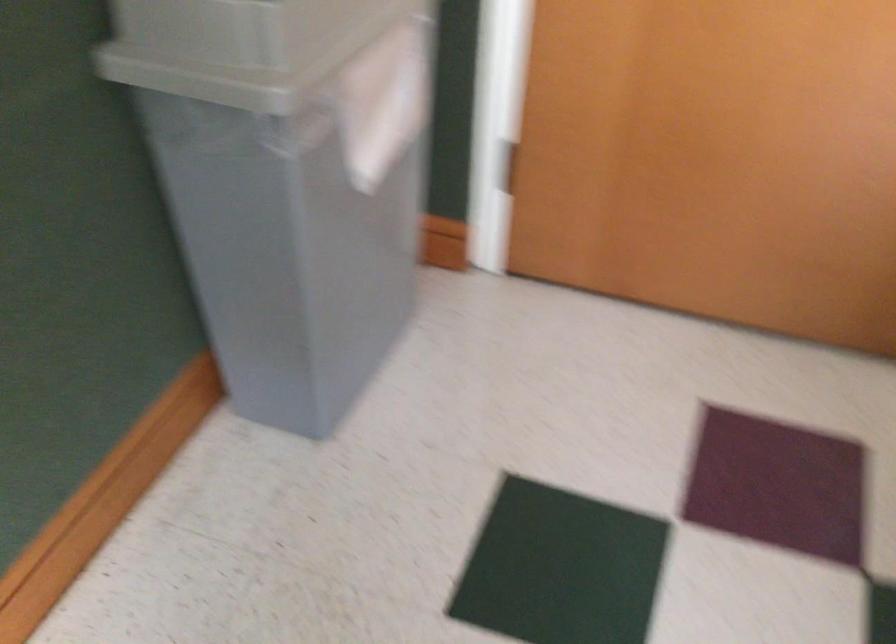
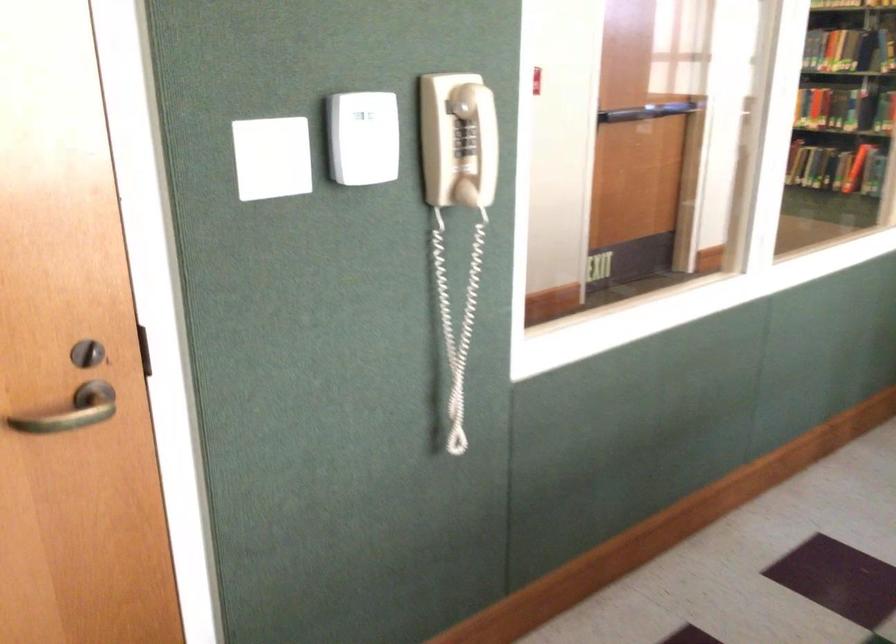
Question: The first image is from the beginning of the video and the second image is from the end. How did the camera likely rotate when shooting the video?

Choices:
 (A) Left
 (B) Right
 (C) Up
 (D) Down

Answer: (B)